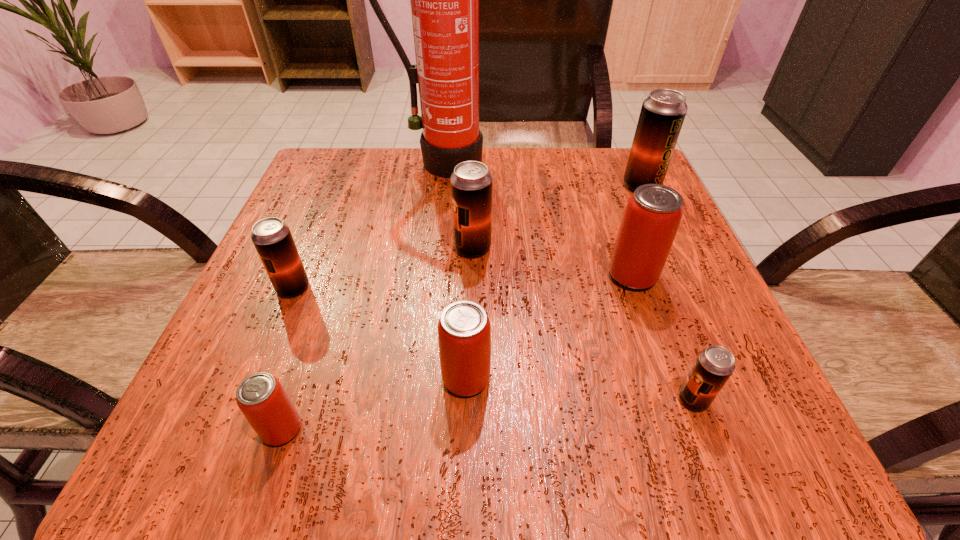
This screenshot has width=960, height=540. I want to click on vacant space located 0.180m on the front of the third biggest black beer can, so click(x=248, y=399).

Image resolution: width=960 pixels, height=540 pixels. Identify the location of free location located 0.070m on the left of the second nearest pink beer can. (393, 379).

Where is `vacant space located 0.320m on the back of the nearest pink beer can`? This screenshot has height=540, width=960. vacant space located 0.320m on the back of the nearest pink beer can is located at coordinates (342, 251).

This screenshot has width=960, height=540. What are the coordinates of `vacant space located on the back of the smallest black beer can` in the screenshot? It's located at (622, 212).

The image size is (960, 540). I want to click on fire extinguisher positioned at the far edge, so (x=444, y=0).

At what (x,y) coordinates should I click in order to perform the action: click on beer can present at the far edge. Please return your answer as a coordinate pair (x, y). Looking at the image, I should click on (663, 112).

Find the location of a particular element. This screenshot has height=540, width=960. object that is positioned at the near left corner is located at coordinates (262, 399).

The image size is (960, 540). Identify the location of object that is positioned at the far right corner. (663, 112).

At what (x,y) coordinates should I click in order to perform the action: click on object that is at the near right corner. Please return your answer as a coordinate pair (x, y). Looking at the image, I should click on (714, 365).

Find the location of a particular element. The height and width of the screenshot is (540, 960). vacant area at the far edge of the desktop is located at coordinates (425, 202).